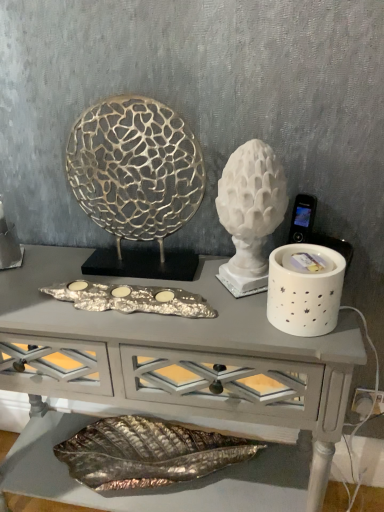
Question: Is silver metallic tray at center shorter than gold textured sculpture at center, the second sculpture viewed from the right?

Choices:
 (A) yes
 (B) no

Answer: (A)

Question: Is silver metallic tray at center oriented away from gold textured sculpture at center, the 1th sculpture from the left?

Choices:
 (A) yes
 (B) no

Answer: (A)

Question: From the image's perspective, does silver metallic tray at center appear higher than gold textured sculpture at center, the 1th sculpture from the left?

Choices:
 (A) yes
 (B) no

Answer: (B)

Question: Is silver metallic tray at center facing towards gold textured sculpture at center, the second sculpture viewed from the right?

Choices:
 (A) no
 (B) yes

Answer: (A)

Question: Does silver metallic tray at center touch gold textured sculpture at center, the 1th sculpture from the left?

Choices:
 (A) no
 (B) yes

Answer: (A)

Question: Does silver metallic tray at center lie behind gold textured sculpture at center, the 1th sculpture from the left?

Choices:
 (A) yes
 (B) no

Answer: (A)

Question: Could you tell me if white marble sculpture at center, which is the second sculpture from left to right, is turned towards white ceramic candle holder at right?

Choices:
 (A) no
 (B) yes

Answer: (A)

Question: Considering the relative positions of white marble sculpture at center, which appears as the first sculpture when viewed from the right, and white ceramic candle holder at right in the image provided, is white marble sculpture at center, which appears as the first sculpture when viewed from the right, to the right of white ceramic candle holder at right from the viewer's perspective?

Choices:
 (A) yes
 (B) no

Answer: (B)

Question: From the image's perspective, is white marble sculpture at center, which is the second sculpture from left to right, beneath white ceramic candle holder at right?

Choices:
 (A) no
 (B) yes

Answer: (A)

Question: Can you see white marble sculpture at center, which appears as the first sculpture when viewed from the right, touching white ceramic candle holder at right?

Choices:
 (A) yes
 (B) no

Answer: (B)

Question: Does white marble sculpture at center, which appears as the first sculpture when viewed from the right, have a smaller size compared to white ceramic candle holder at right?

Choices:
 (A) no
 (B) yes

Answer: (A)

Question: Would you say white ceramic candle holder at right is part of white marble sculpture at center, which appears as the first sculpture when viewed from the right,'s contents?

Choices:
 (A) yes
 (B) no

Answer: (B)

Question: Does gold textured sculpture at center, the second sculpture viewed from the right, appear on the left side of silver metallic tray at center?

Choices:
 (A) yes
 (B) no

Answer: (B)